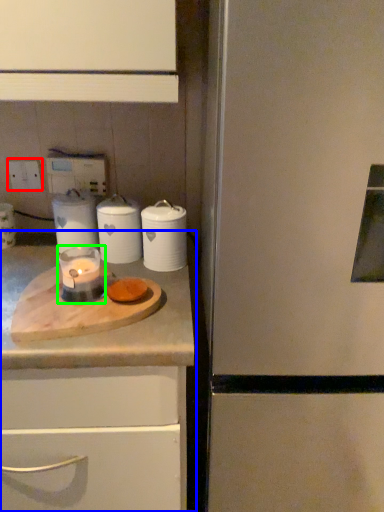
Question: Considering the real-world distances, which object is farthest from electric outlet (highlighted by a red box)? countertop (highlighted by a blue box) or candle holder (highlighted by a green box)?

Choices:
 (A) countertop
 (B) candle holder

Answer: (A)